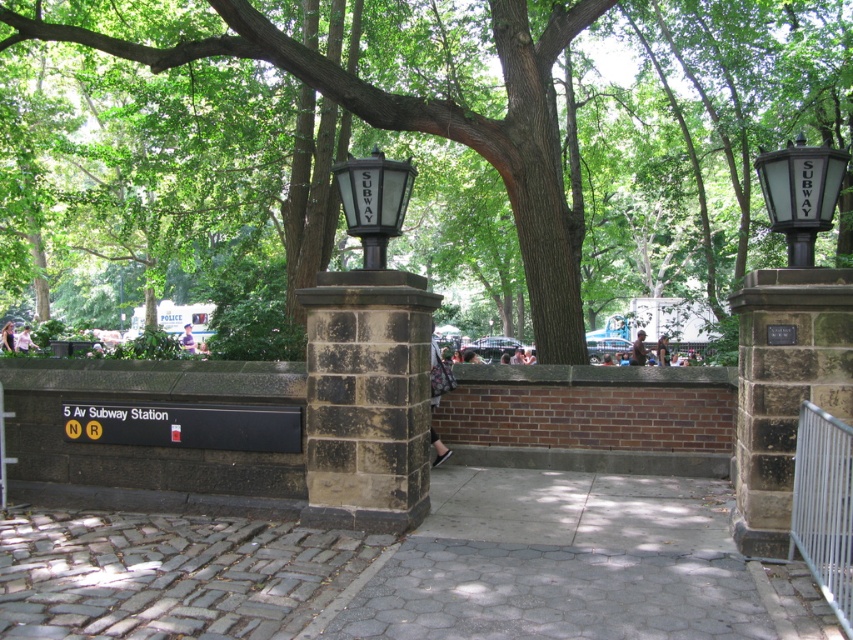
You are standing at the 5 Av Subway Station entrance and want to place a small potted plant exactly at the center of the gray cobblestone pavement at center. According to the image, what are the coordinates where you should place the plant?

The gray cobblestone pavement at center is located at point coordinates of (416, 568). Therefore, you should place the potted plant at those coordinates.

You are standing at the subway entrance of 5 Av Subway Station and see two points marked on the cobblestone ground. The first point is at coordinate point (x=792, y=202) and the second is at point (x=397, y=177). Which point is closer to you?

Point (x=792, y=202) is closer to the viewer than point (x=397, y=177).

You are a delivery person carrying a large package that is 2 meters wide. You need to walk through the 5 Av Subway Station entrance shown in the image. Considering the gray cobblestone pavement at center and the clear glass streetlight at upper right, will your package fit through the space between them?

The gray cobblestone pavement at center has a larger size compared to the clear glass streetlight at upper right. Since the pavement is larger, the space between them should be wide enough for a 2 meter wide package to pass through.